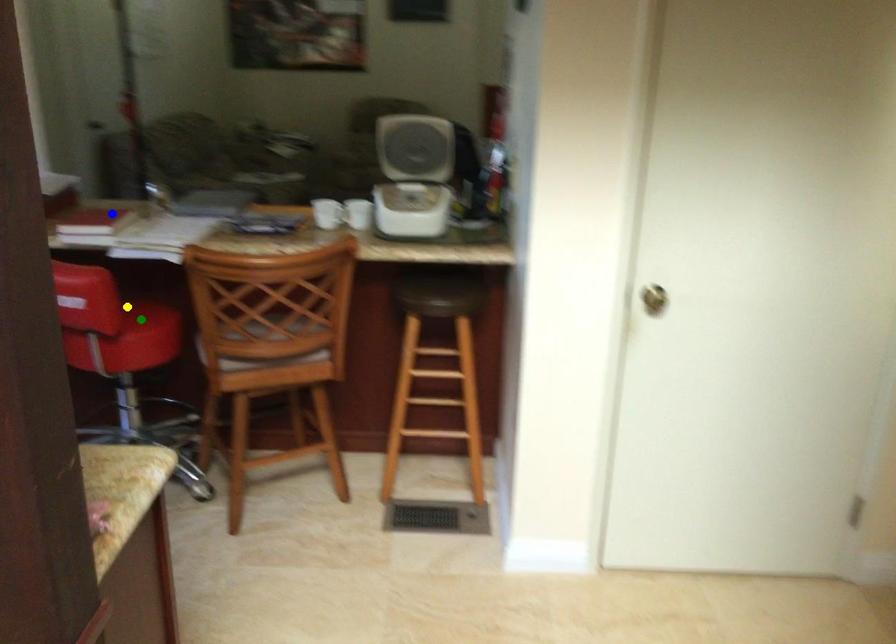
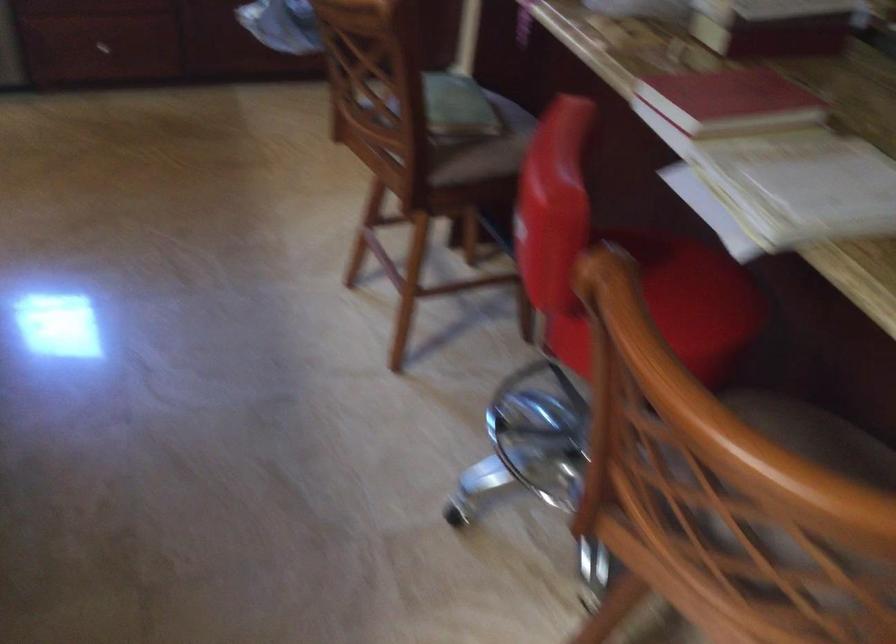
I am providing you with two images of the same scene from different viewpoints. Three points are marked in image1. Which point corresponds to a part or object that is occluded in image2?In image1, three points are marked. Which of them correspond to a part or object that is occluded in image2?Among the three points shown in image1, which one corresponds to a part or object that is no longer visible due to occlusion in image2?

green point